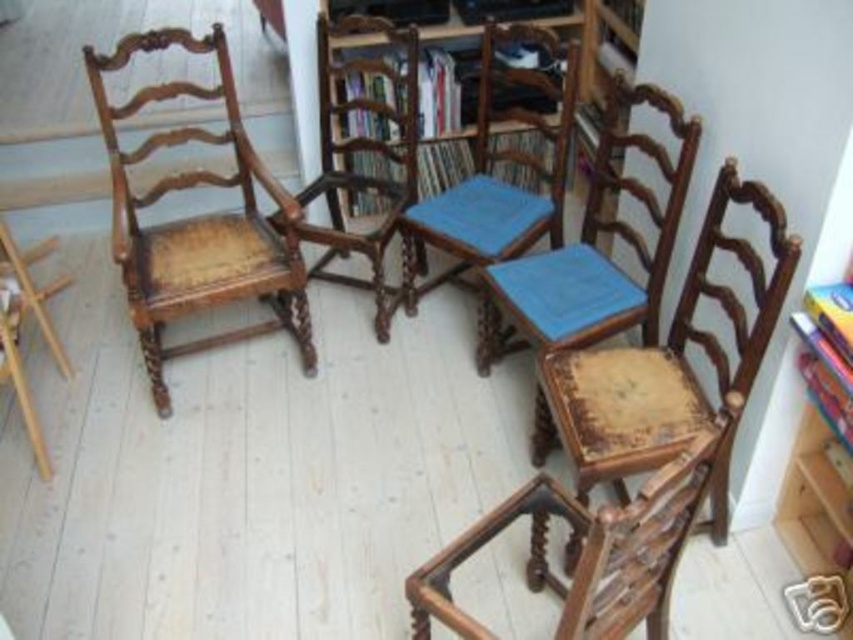
You are a guest entering the room and want to sit closest to the bookshelf. Which chair should you choose between the wooden textured rocking chair at lower right and the wooden textured chair at center?

The wooden textured rocking chair at lower right is in front of the wooden textured chair at center, so the wooden textured chair at center is closer to the bookshelf. Choose the wooden textured chair at center.

You are planning to place a rectangular table that is 1.2 meters wide between the wooden textured chair at center and the wooden armchair at center. Based on their widths, will the table fit between them?

The wooden textured chair at center is wider than the wooden armchair at center. Since the table is 1.2 meters wide, it depends on the combined width of both chairs. However, without knowing the exact widths of the chairs, we cannot determine if the table will fit.